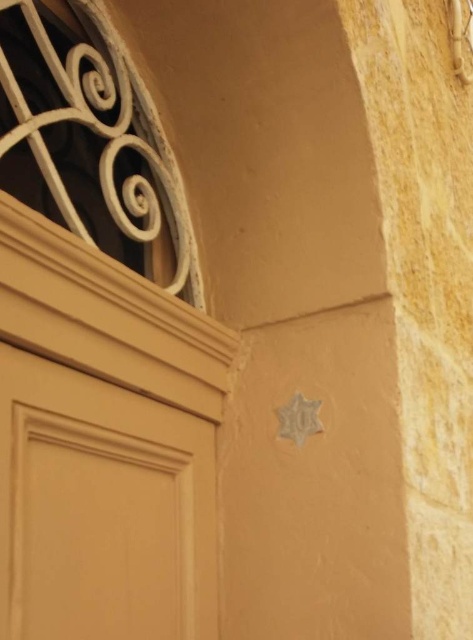
You are standing in front of the building and notice the matte wood door at lower left and the white matte spiral at upper left. Which object is located to the right of the other?

The matte wood door at lower left is positioned on the right side of the white matte spiral at upper left, so the matte wood door at lower left is to the right of the white matte spiral at upper left.

You are a delivery person holding a package that requires a 36 inch clearance to deliver. You approach the matte wood door at lower left. Can you fit the package through the space available?

The matte wood door at lower left is 35.06 inches from the camera, which is slightly less than the required 36 inch clearance. Therefore, the package cannot fit through the space available.